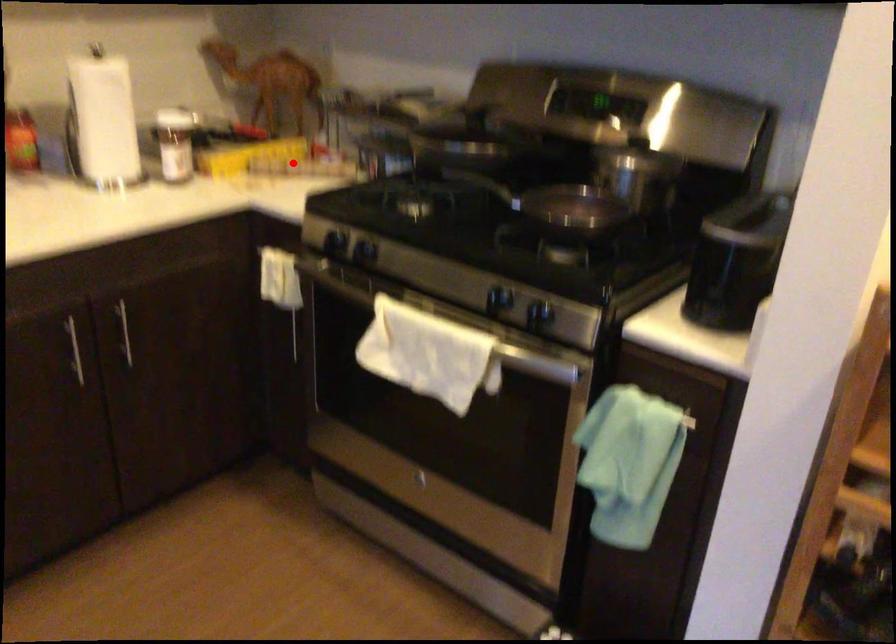
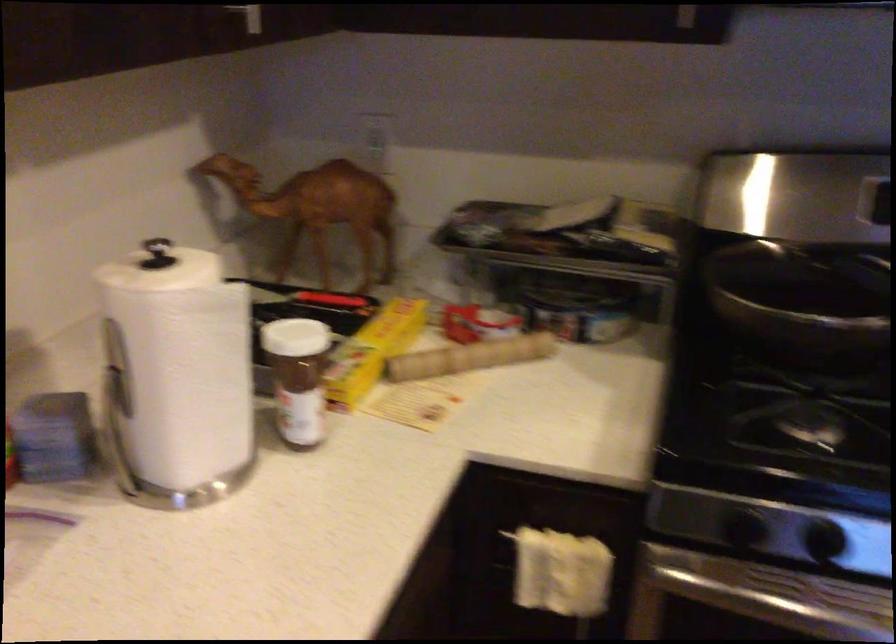
Question: I am providing you with two images of the same scene from different viewpoints. Image1 has a red point marked. In image2, the corresponding 3D location appears at what relative position? Reply with the corresponding letter.

Choices:
 (A) Closer
 (B) Farther

Answer: (A)